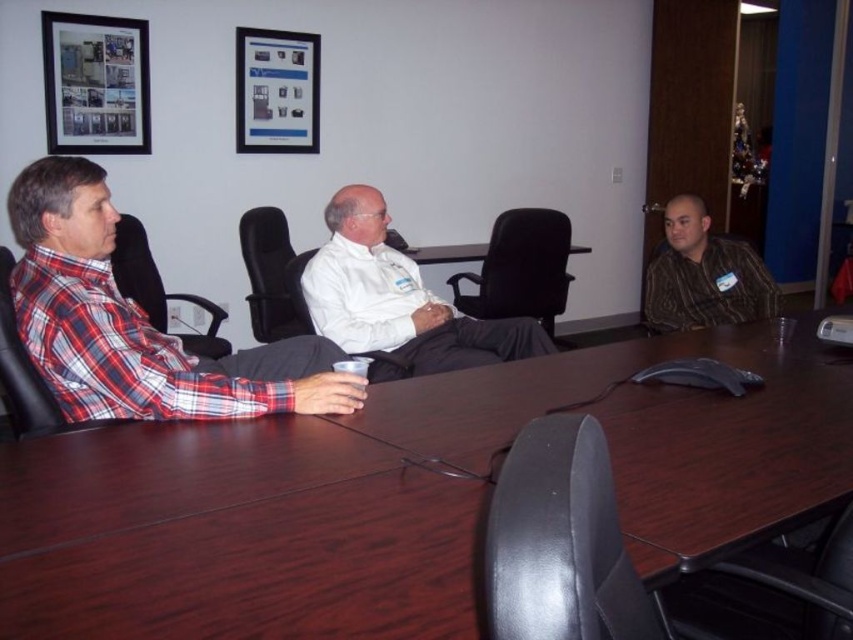
You are organizing a small gathering and need to place a decorative centerpiece on the brown wood table at center. Considering the size of the plaid fabric shirt at left, will the table be wide enough to accommodate the centerpiece without it overlapping the shirt?

The brown wood table at center might be wider than plaid fabric shirt at left, so there is a possibility that the table is wide enough to place the centerpiece without overlapping the shirt. However, the exact dimensions are uncertain based on the given information.